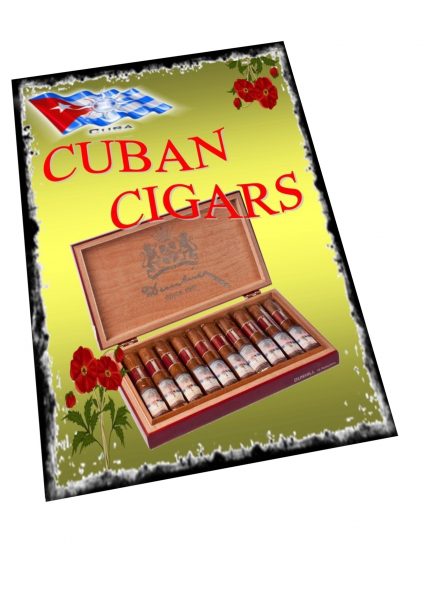
Identify the location of lid of cigar box. The width and height of the screenshot is (424, 600). (193, 269).